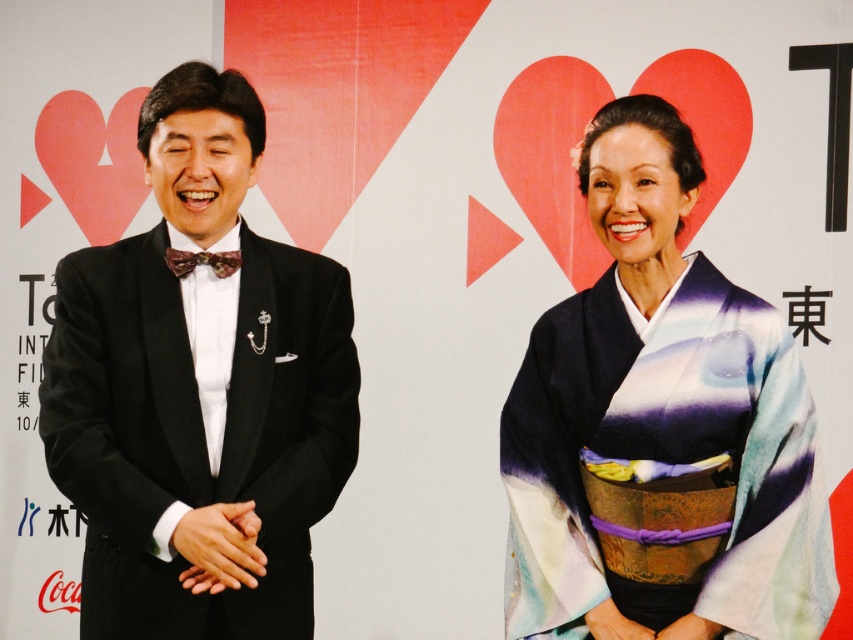
Between point (306, 280) and point (228, 253), which one is positioned in front?

Point (228, 253) is more forward.

Does point (268, 323) come farther from viewer compared to point (199, 252)?

That is True.

Is point (292, 291) closer to viewer compared to point (173, 257)?

No, it is behind (173, 257).

Find the location of `black satin tuxedo at left`. black satin tuxedo at left is located at coordinates (x=199, y=392).

Is black satin tuxedo at left to the left of silky kimono at right from the viewer's perspective?

Correct, you'll find black satin tuxedo at left to the left of silky kimono at right.

Between black satin tuxedo at left and silky kimono at right, which one has more height?

Standing taller between the two is black satin tuxedo at left.

Between point (79, 420) and point (645, 604), which one is positioned behind?

The point (645, 604) is more distant.

The height and width of the screenshot is (640, 853). Find the location of `black satin tuxedo at left`. black satin tuxedo at left is located at coordinates (199, 392).

In the scene shown: Who is higher up, silky kimono at right or shiny purple bow tie at center?

shiny purple bow tie at center is higher up.

Which is behind, point (572, 596) or point (166, 250)?

The point (166, 250) is more distant.

Which is in front, point (732, 614) or point (183, 275)?

Point (732, 614) is in front.

The height and width of the screenshot is (640, 853). I want to click on silky kimono at right, so click(660, 426).